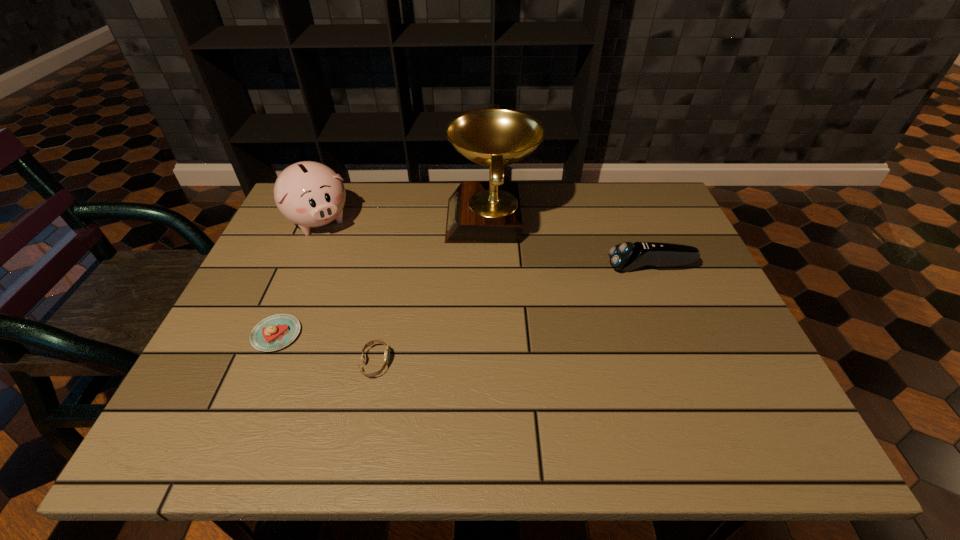
Locate an element on the screen. object that is at the right edge is located at coordinates (627, 256).

The width and height of the screenshot is (960, 540). What are the coordinates of `object positioned at the far left corner` in the screenshot? It's located at (310, 194).

Image resolution: width=960 pixels, height=540 pixels. In the image, there is a desktop. Find the location of `vacant space at the far edge`. vacant space at the far edge is located at coordinates (540, 187).

What are the coordinates of `blank area at the near edge` in the screenshot? It's located at (368, 431).

Where is `free location at the left edge`? The image size is (960, 540). free location at the left edge is located at coordinates (280, 267).

Identify the location of vacant space at the right edge of the desktop. This screenshot has width=960, height=540. (727, 328).

The width and height of the screenshot is (960, 540). I want to click on vacant space in between the piggy bank and the third object from right to left, so click(348, 292).

You are a GUI agent. You are given a task and a screenshot of the screen. Output one action in this format:
    pyautogui.click(x=<x>, y=<y>)
    Task: Click on the empty space between the rightmost object and the award
    The height and width of the screenshot is (540, 960).
    Given the screenshot: What is the action you would take?
    pyautogui.click(x=571, y=244)

Find the location of a particular element. free spot between the third object from right to left and the third tallest object is located at coordinates (513, 315).

Image resolution: width=960 pixels, height=540 pixels. I want to click on vacant area between the pastry and the third object from right to left, so click(x=326, y=348).